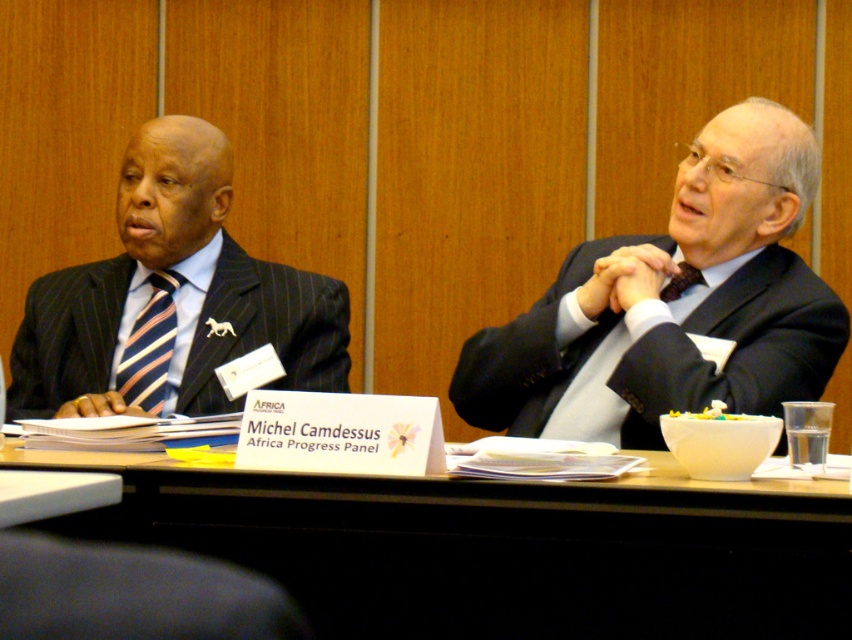
Question: Which object appears farthest from the camera in this image?

Choices:
 (A) striped fabric tie at left
 (B) matte black suit at center
 (C) wooden table at center
 (D) dark brown silk tie at center

Answer: (A)

Question: Does dark gray fabric at lower left have a smaller size compared to striped fabric tie at left?

Choices:
 (A) yes
 (B) no

Answer: (A)

Question: Does dark gray fabric at lower left lie behind dark brown silk tie at center?

Choices:
 (A) yes
 (B) no

Answer: (B)

Question: Which of the following is the farthest from the observer?

Choices:
 (A) striped fabric tie at left
 (B) dark brown silk tie at center
 (C) matte black suit at center

Answer: (A)

Question: Which object appears closest to the camera in this image?

Choices:
 (A) dark gray fabric at lower left
 (B) matte black suit at center

Answer: (A)

Question: Can you confirm if matte black suit at center is positioned above dark gray fabric at lower left?

Choices:
 (A) yes
 (B) no

Answer: (A)